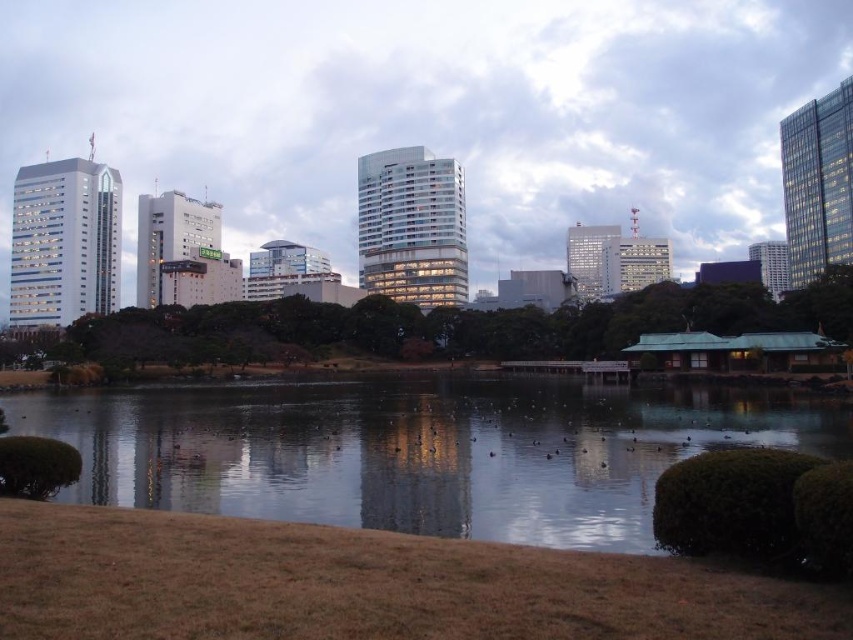
You are a city planner reviewing this urban layout. The matte glass buildings at center and clear water at center are key elements. Which of these two elements occupies a larger area in the scene?

The matte glass buildings at center is larger in size than clear water at center, so the matte glass buildings at center occupies a larger area in the scene.

You are standing at the point closer to the camera between the two points, point (643, 16) and point (740, 387). Which point are you standing at?

You are standing at point (643, 16) because it is further to the camera than point (740, 387).